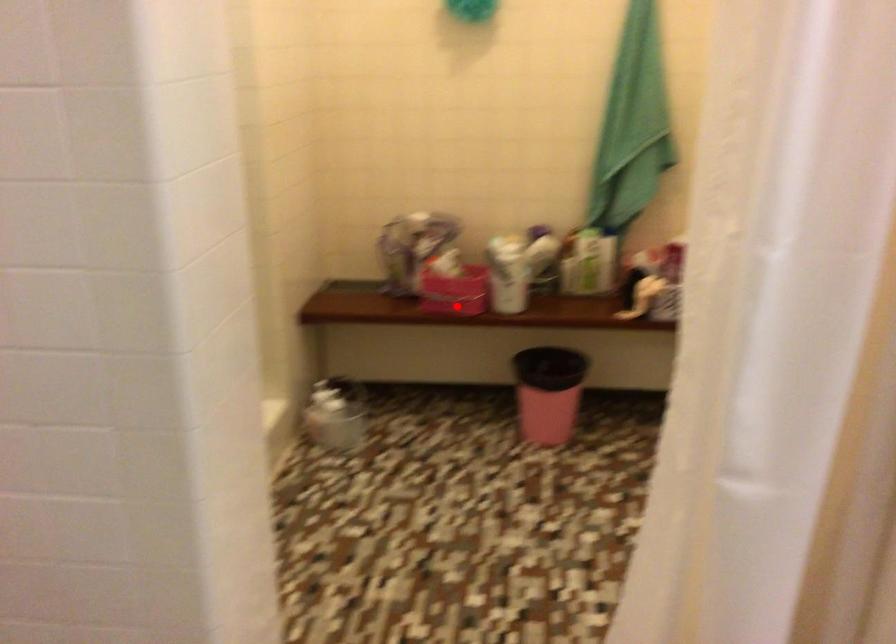
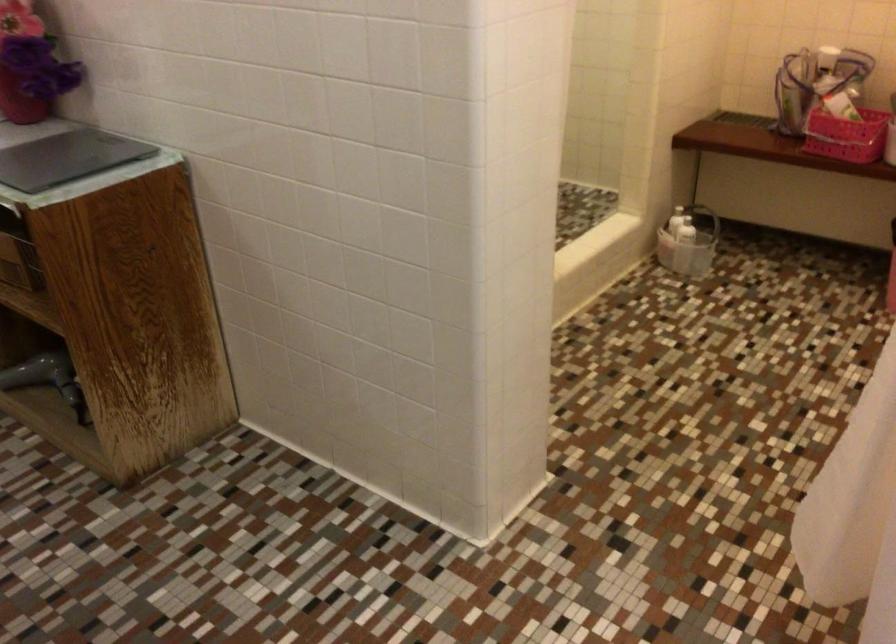
Find the pixel in the second image that matches the highlighted location in the first image.

(847, 136)